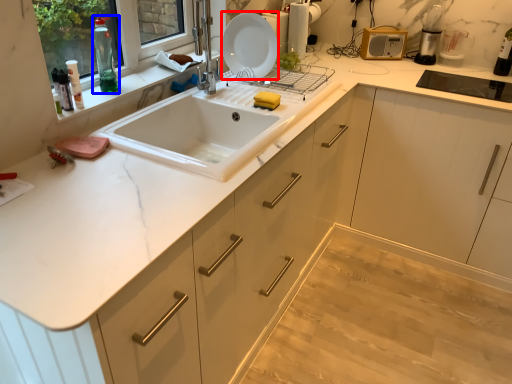
Question: Which point is closer to the camera, plate (highlighted by a red box) or bottle (highlighted by a blue box)?

Choices:
 (A) plate
 (B) bottle

Answer: (B)